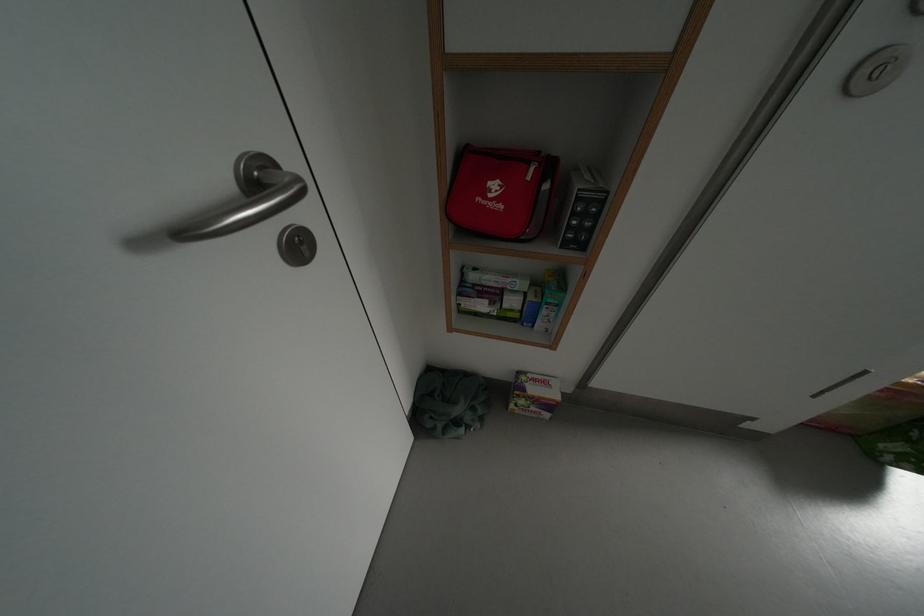
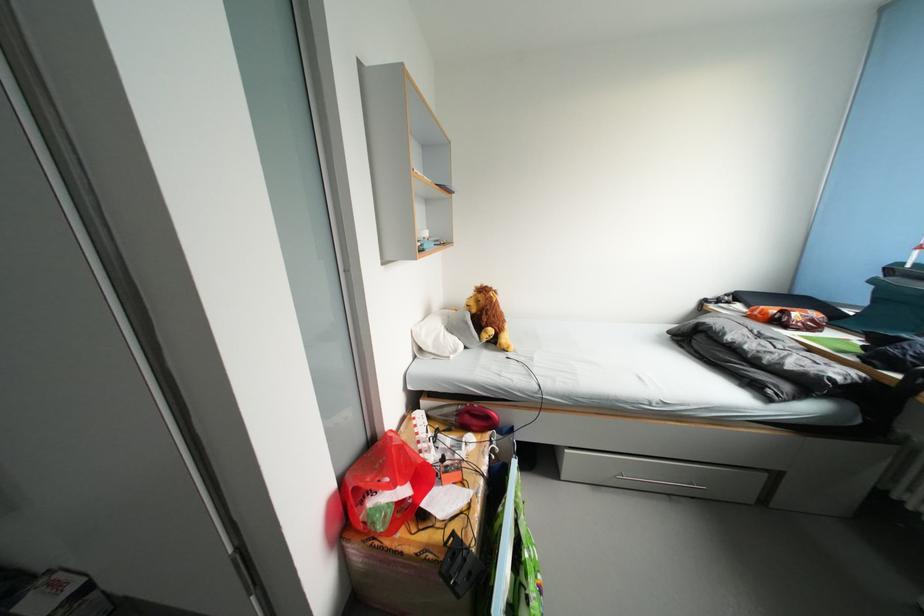
Question: The images are taken continuously from a first-person perspective. In which direction are you moving?

Choices:
 (A) Left
 (B) Right
 (C) Forward
 (D) Backward

Answer: (B)